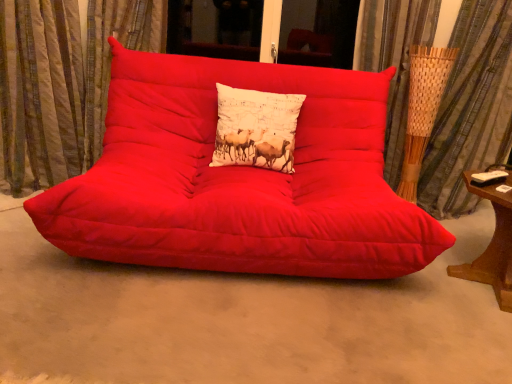
Identify the location of free space in front of wooden side table at right. (471, 329).